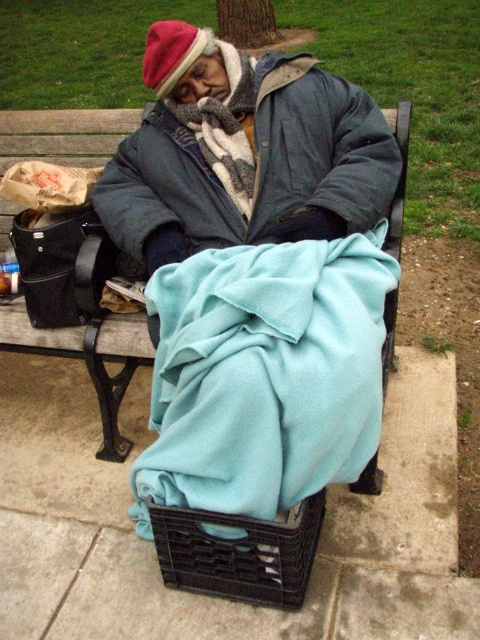
Question: Which of the following is the closest to the observer?

Choices:
 (A) (115, 428)
 (B) (168, 211)

Answer: (B)

Question: Based on their relative distances, which object is farther from the wooden bench at center?

Choices:
 (A) matte blue blanket at center
 (B) teal fleece blanket at lower center

Answer: (A)

Question: From the image, what is the correct spatial relationship of matte blue blanket at center in relation to wooden bench at center?

Choices:
 (A) right
 (B) left

Answer: (A)

Question: Can you confirm if matte blue blanket at center is positioned above wooden bench at center?

Choices:
 (A) no
 (B) yes

Answer: (B)

Question: Estimate the real-world distances between objects in this image. Which object is farther from the wooden bench at center?

Choices:
 (A) matte blue blanket at center
 (B) teal fleece blanket at lower center

Answer: (A)

Question: Does teal fleece blanket at lower center appear over wooden bench at center?

Choices:
 (A) no
 (B) yes

Answer: (A)